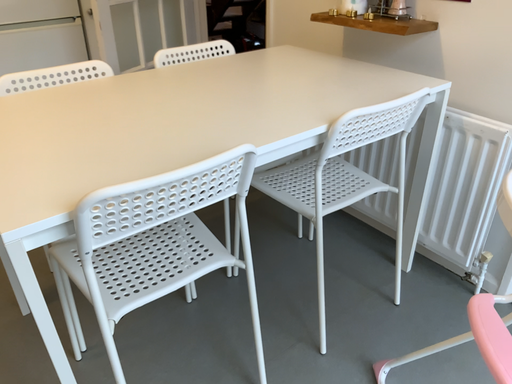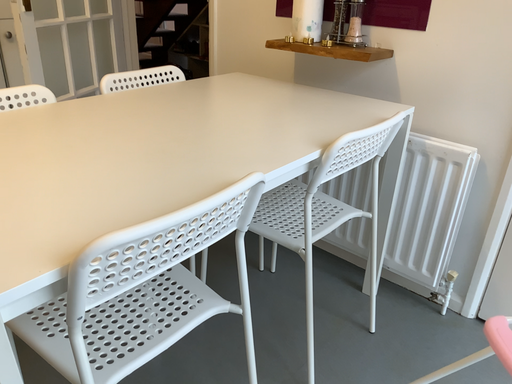
Question: Which way did the camera rotate in the video?

Choices:
 (A) rotated left
 (B) rotated right

Answer: (B)